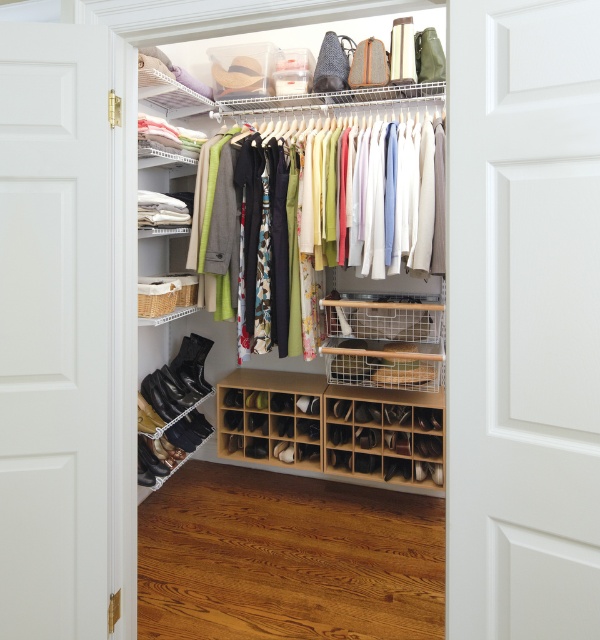
Can you confirm if white wood door at left is thinner than wooden shoe rack at lower center?

Correct, white wood door at left's width is less than wooden shoe rack at lower center's.

Is point (85, 388) in front of point (418, 400)?

That is True.

You are a GUI agent. You are given a task and a screenshot of the screen. Output one action in this format:
    pyautogui.click(x=<x>, y=<y>)
    Task: Click on the white wood door at left
    
    Given the screenshot: What is the action you would take?
    pyautogui.click(x=64, y=332)

Is white painted wood door at center further to camera compared to matte white hanger at center?

No, white painted wood door at center is closer to the viewer.

Who is positioned more to the left, white painted wood door at center or matte white hanger at center?

From the viewer's perspective, matte white hanger at center appears more on the left side.

Which is behind, point (474, 32) or point (370, 122)?

The point (370, 122) is more distant.

The height and width of the screenshot is (640, 600). In order to click on white painted wood door at center in this screenshot , I will do `click(523, 320)`.

Can you confirm if white wood door at left is smaller than matte white hanger at center?

Yes.

Locate an element on the screen. The width and height of the screenshot is (600, 640). white wood door at left is located at coordinates (64, 332).